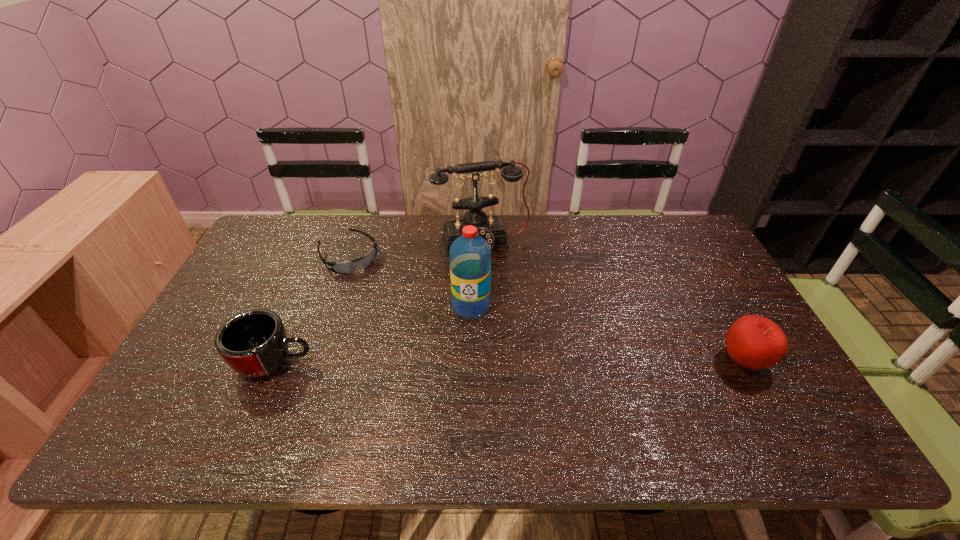
Locate an element on the screen. mug is located at coordinates (254, 344).

Find the location of a particular element. This screenshot has height=540, width=960. the rightmost object is located at coordinates (x=753, y=341).

At what (x,y) coordinates should I click in order to perform the action: click on the third farthest object. Please return your answer as a coordinate pair (x, y). The height and width of the screenshot is (540, 960). Looking at the image, I should click on (470, 256).

This screenshot has height=540, width=960. Find the location of `the shortest object`. the shortest object is located at coordinates (349, 267).

You are a GUI agent. You are given a task and a screenshot of the screen. Output one action in this format:
    pyautogui.click(x=<x>, y=<y>)
    Task: Click on the telephone
    
    Given the screenshot: What is the action you would take?
    pyautogui.click(x=491, y=228)

At what (x,y) coordinates should I click in order to perform the action: click on free space located on the side of the mug with the handle. Please return your answer as a coordinate pair (x, y). Looking at the image, I should click on (447, 362).

I want to click on free space located on the left of the apple, so click(599, 361).

Identify the location of free spot located on the front label of the water bottle. (445, 370).

Locate an element on the screen. The image size is (960, 540). free location located on the front label of the water bottle is located at coordinates (461, 333).

Find the location of `vacant space situated on the front label of the water bottle`. vacant space situated on the front label of the water bottle is located at coordinates (455, 347).